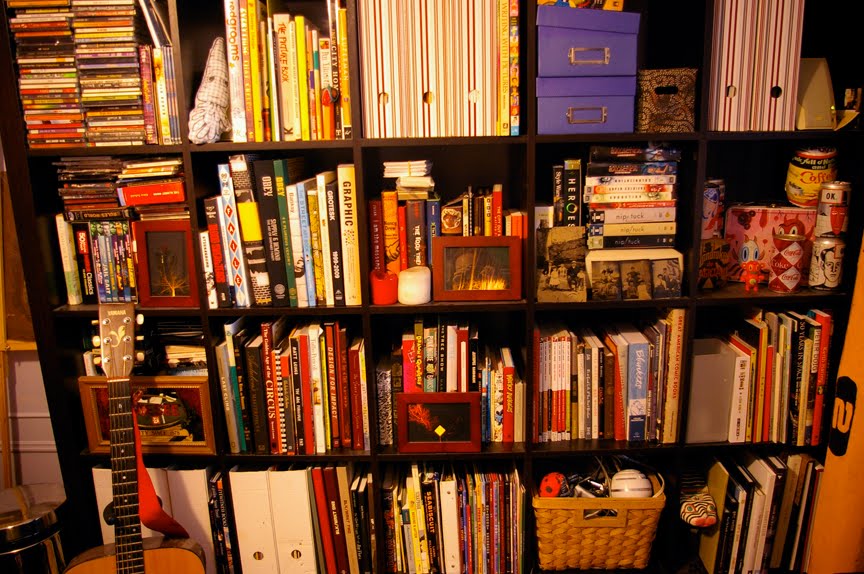
You are a GUI agent. You are given a task and a screenshot of the screen. Output one action in this format:
    pyautogui.click(x=<x>, y=<y>)
    Task: Click on the basket
    
    Given the screenshot: What is the action you would take?
    pyautogui.click(x=592, y=544)